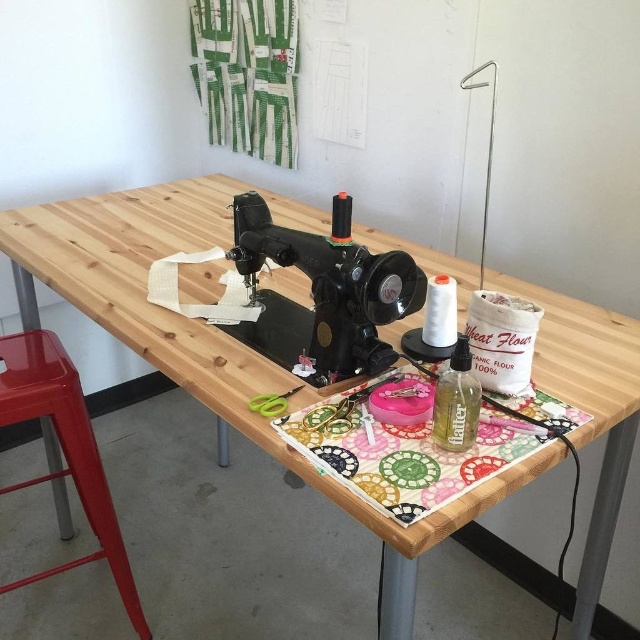
You are organizing the sewing table and want to place a new tool between the metallic red stool at lower left and the green plastic scissors at center. Based on their positions, where should you place the tool?

Since the metallic red stool at lower left is to the left of the green plastic scissors at center, you should place the new tool between them, ensuring it is positioned to the right of the metallic red stool at lower left and to the left of the green plastic scissors at center.

You are a person with a 16 inch wide sewing kit box. You want to place it between the wooden table at center and the metallic red stool at lower left. Will it fit?

The distance between the wooden table at center and the metallic red stool at lower left is 18.45 inches. Since the box is 16 inches wide, it will fit as there is enough space between them.

You are standing at the edge of the table where the sewing machine is placed. You need to reach the metallic red stool at lower left. Is the stool located near the edge of the table or closer to the center?

The metallic red stool at lower left is located near the edge of the table since its position at point (65, 451) indicates it is closer to the edge rather than the center.